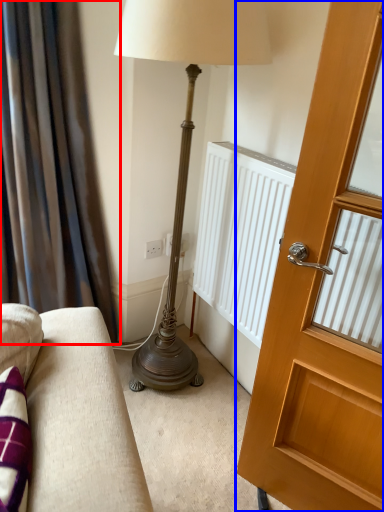
Question: Among these objects, which one is nearest to the camera, curtain (highlighted by a red box) or door (highlighted by a blue box)?

Choices:
 (A) curtain
 (B) door

Answer: (B)